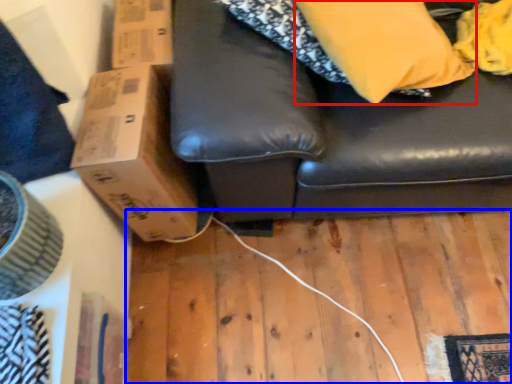
Question: Which object is further to the camera taking this photo, pillow (highlighted by a red box) or plywood (highlighted by a blue box)?

Choices:
 (A) pillow
 (B) plywood

Answer: (B)